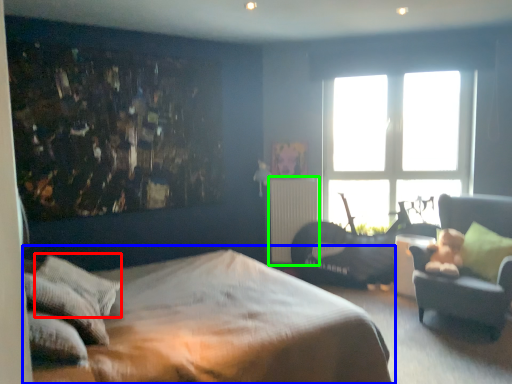
Question: Which object is the closest to the pillow (highlighted by a red box)? Choose among these: bed (highlighted by a blue box) or radiator (highlighted by a green box).

Choices:
 (A) bed
 (B) radiator

Answer: (A)